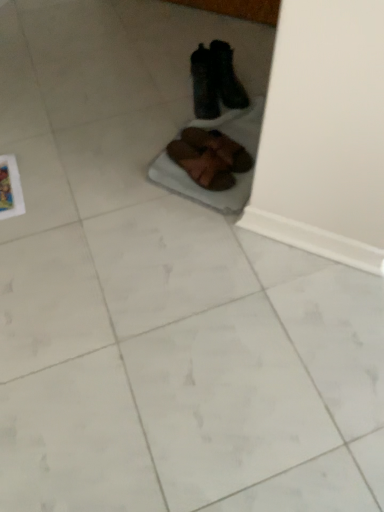
Identify the location of vacant space situated on the left part of brown suede shoes at center, which ranks as the third footwear in top-to-bottom order. (164, 162).